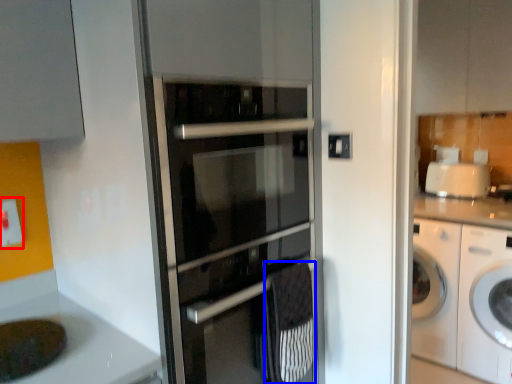
Question: Which of the following is the farthest to the observer, electric outlet (highlighted by a red box) or material (highlighted by a blue box)?

Choices:
 (A) electric outlet
 (B) material

Answer: (A)